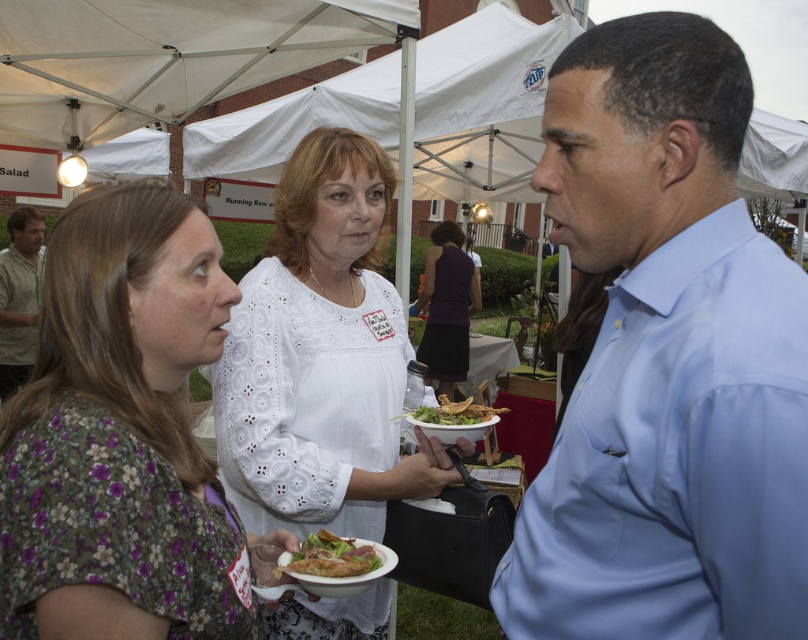
Is dark purple dress at center shorter than green textured shirt at left?

In fact, dark purple dress at center may be taller than green textured shirt at left.

Is point (442, 266) in front of point (20, 208)?

Yes, it is.

You are a GUI agent. You are given a task and a screenshot of the screen. Output one action in this format:
    pyautogui.click(x=<x>, y=<y>)
    Task: Click on the dark purple dress at center
    
    Given the screenshot: What is the action you would take?
    pyautogui.click(x=445, y=307)

Can you confirm if dark purple dress at center is wider than crunchy fried chicken at center?

Indeed, dark purple dress at center has a greater width compared to crunchy fried chicken at center.

Looking at this image, which is above, dark purple dress at center or crunchy fried chicken at center?

dark purple dress at center is higher up.

The image size is (808, 640). I want to click on dark purple dress at center, so click(x=445, y=307).

The image size is (808, 640). I want to click on dark purple dress at center, so click(x=445, y=307).

Does point (142, 342) come in front of point (36, 317)?

Yes, point (142, 342) is in front of point (36, 317).

Is point (11, 525) behind point (19, 218)?

No.

Where is `floral fabric dress at center`? The image size is (808, 640). floral fabric dress at center is located at coordinates (121, 422).